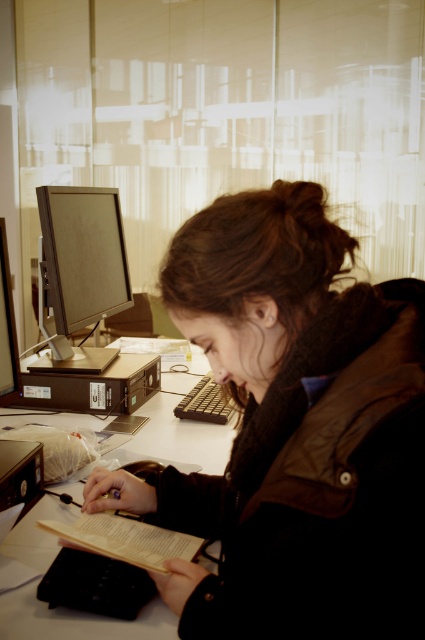
In the scene shown: You are designing a new desk organizer and need to know the height of the white plastic computer desk at center compared to the matte black monitor at left. Which one is shorter?

The white plastic computer desk at center is shorter than the matte black monitor at left.

You are a delivery person who just arrived at the desk. You need to place a small package that is 10 inches long on the desk without moving any items. Is there enough space between the dark brown knit scarf at center and the light brown paper book at lower center to fit the package?

The dark brown knit scarf at center and light brown paper book at lower center are 9.08 inches apart. Since the package is 10 inches long, which is longer than the space between them, there is not enough space to fit the package without moving any items.